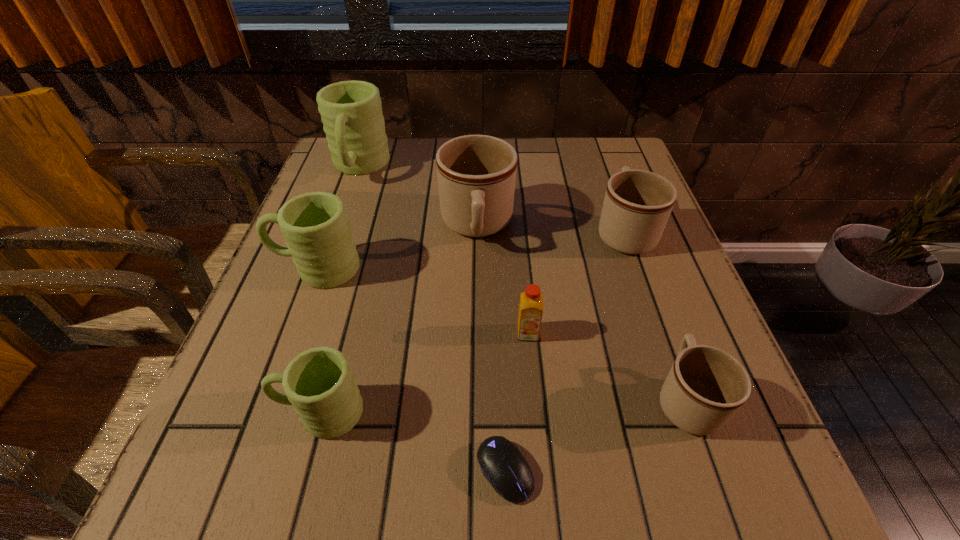
Select which brown mug appears as the closest to the computer mouse. Please provide its 2D coordinates. Your answer should be formatted as a tuple, i.e. [(x, y)], where the tuple contains the x and y coordinates of a point satisfying the conditions above.

[(706, 386)]

You are a GUI agent. You are given a task and a screenshot of the screen. Output one action in this format:
    pyautogui.click(x=<x>, y=<y>)
    Task: Click on the free location that satisfies the following two spatial constraints: 1. on the side of the second biggest green mug with the handle; 2. on the side of the nearest brown mug with the handle
    This screenshot has height=540, width=960.
    Given the screenshot: What is the action you would take?
    pyautogui.click(x=269, y=399)

At what (x,y) coordinates should I click in order to perform the action: click on vacant region that satisfies the following two spatial constraints: 1. on the side of the nearest brown mug with the handle; 2. on the side of the second nearest green mug with the handle. Please return your answer as a coordinate pair (x, y). This screenshot has width=960, height=540. Looking at the image, I should click on (639, 268).

The image size is (960, 540). What are the coordinates of `free region that satisfies the following two spatial constraints: 1. on the side of the biggest brown mug with the handle; 2. on the side of the second farthest green mug with the handle` in the screenshot? It's located at (476, 268).

Locate an element on the screen. free space that satisfies the following two spatial constraints: 1. on the side of the leftmost brown mug with the handle; 2. on the side of the second nearest green mug with the handle is located at coordinates (476, 268).